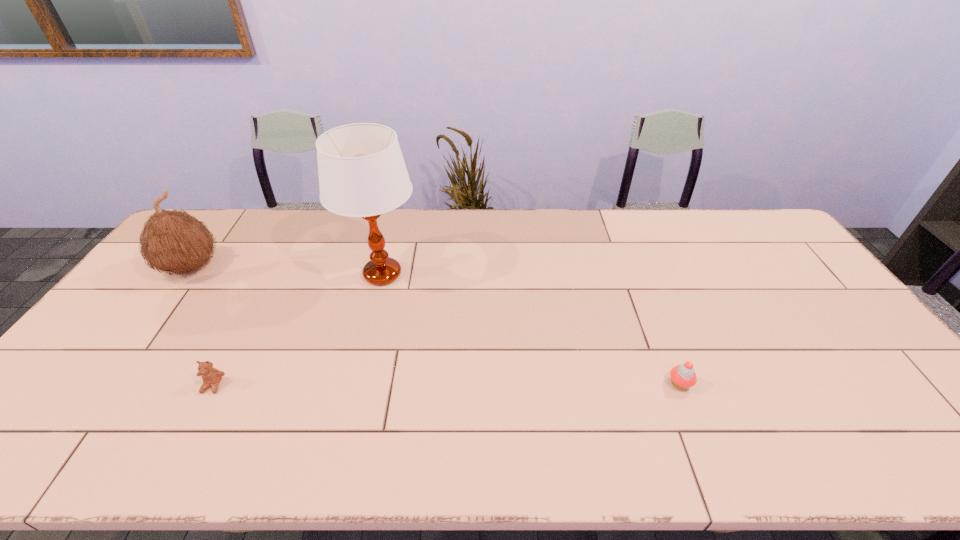
Identify the location of the third object from left to right. (362, 173).

Identify the location of the tallest object. (362, 173).

You are a GUI agent. You are given a task and a screenshot of the screen. Output one action in this format:
    pyautogui.click(x=<x>, y=<y>)
    Task: Click on the second tallest object
    The image size is (960, 540).
    Given the screenshot: What is the action you would take?
    pos(172,241)

The image size is (960, 540). Identify the location of the leftmost object. (172, 241).

Locate an element on the screen. This screenshot has height=540, width=960. teddy bear is located at coordinates (x=211, y=377).

This screenshot has width=960, height=540. What are the coordinates of `the rightmost object` in the screenshot? It's located at (683, 376).

What are the coordinates of `free point located on the front of the third object from left to right` in the screenshot? It's located at (371, 322).

You are a GUI agent. You are given a task and a screenshot of the screen. Output one action in this format:
    pyautogui.click(x=<x>, y=<y>)
    Task: Click on the free location located 0.290m on the surface of the coconut
    
    Given the screenshot: What is the action you would take?
    pyautogui.click(x=118, y=366)

The height and width of the screenshot is (540, 960). Identify the location of vacant space located on the face of the teddy bear. (186, 437).

Locate an element on the screen. vacant space located 0.100m on the left of the cupcake is located at coordinates [628, 384].